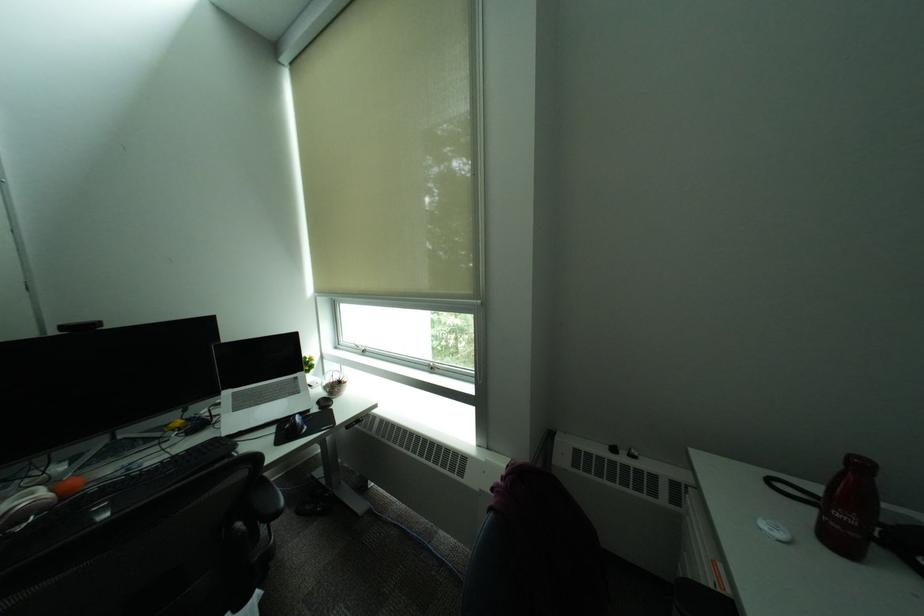
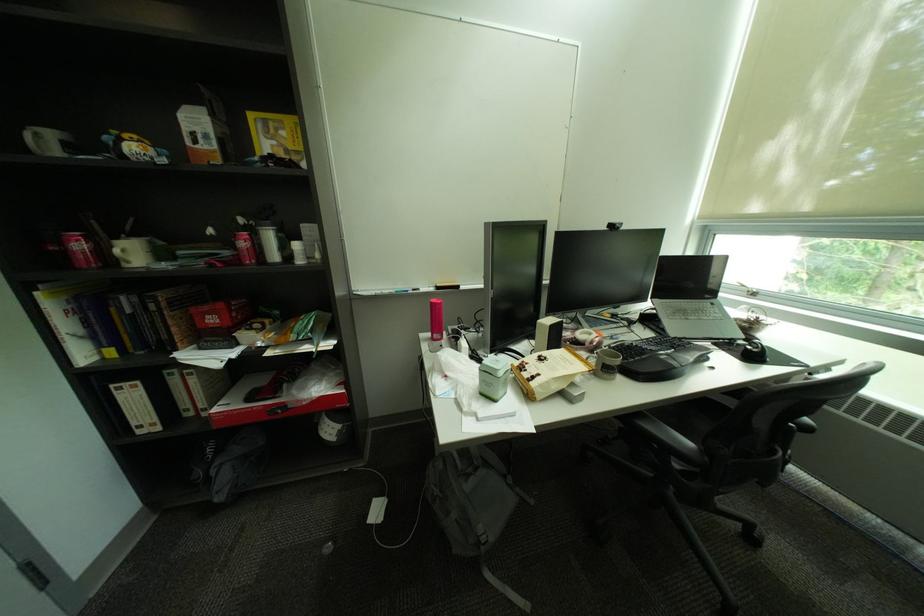
Find the pixel in the second image that matches point 75,330 in the first image.

(621, 227)